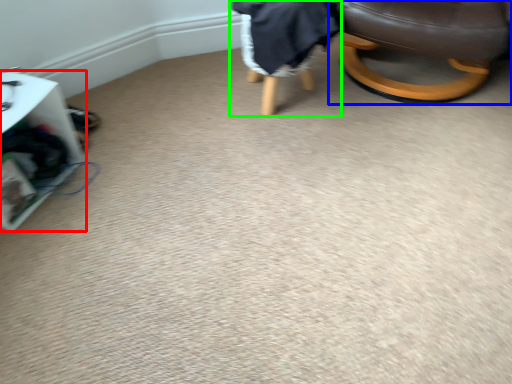
Question: Which is farther away from furniture (highlighted by a red box)? chair (highlighted by a blue box) or bean bag chair (highlighted by a green box)?

Choices:
 (A) chair
 (B) bean bag chair

Answer: (A)